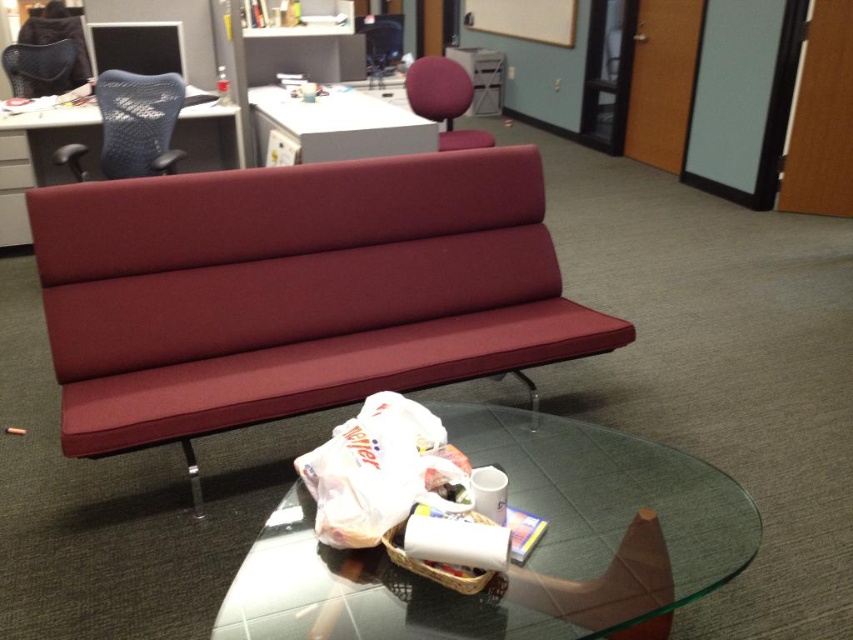
You are an office worker who needs to move a document from the matte black chair at upper left to the matte plastic table at upper center. Based on the scene, can you directly place the document on the table without moving from your current position?

The matte plastic table at upper center is located below the matte black chair at upper left, so you can directly place the document on the table without needing to move from your current position.